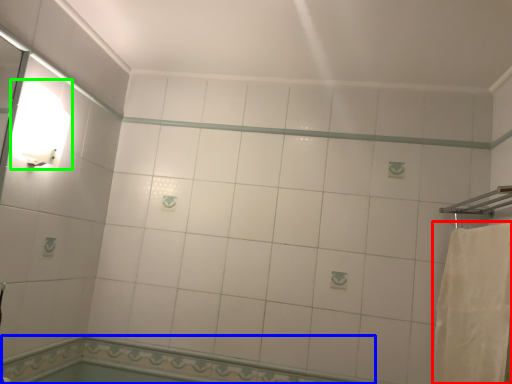
Question: Considering the real-world distances, which object is farthest from bath towel (highlighted by a red box)? bath (highlighted by a blue box) or light fixture (highlighted by a green box)?

Choices:
 (A) bath
 (B) light fixture

Answer: (B)